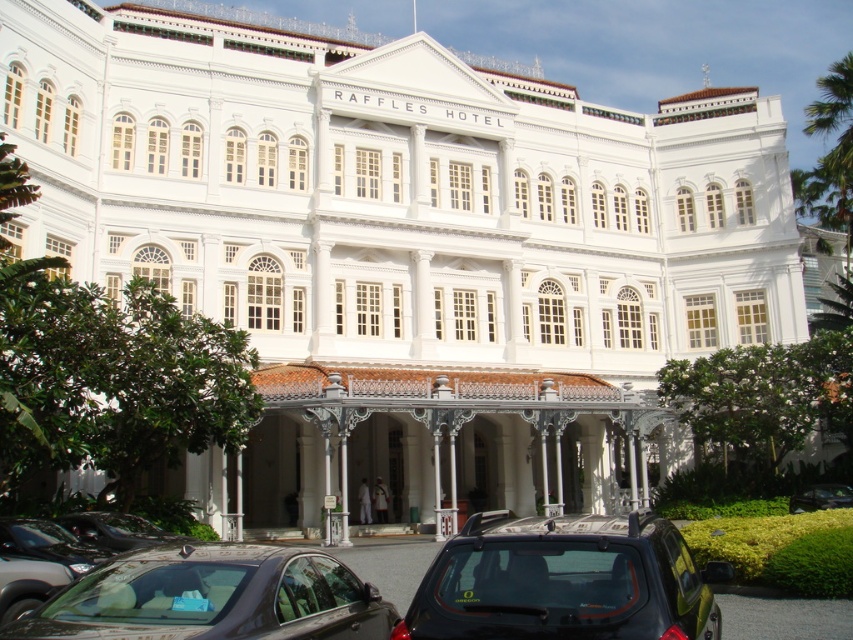
Is black matte car at lower center closer to camera compared to shiny black sedan at lower center?

No.

Can you confirm if black matte car at lower center is bigger than shiny black sedan at lower center?

Yes, black matte car at lower center is bigger than shiny black sedan at lower center.

Which is behind, point (457, 576) or point (144, 572)?

Point (457, 576)

Image resolution: width=853 pixels, height=640 pixels. Find the location of `black matte car at lower center`. black matte car at lower center is located at coordinates (564, 580).

Is the position of shiny silver car at lower left less distant than that of metallic silver car at lower center?

Yes.

Between point (39, 577) and point (833, 499), which one is positioned behind?

The point (833, 499) is behind.

Locate an element on the screen. shiny silver car at lower left is located at coordinates (38, 563).

Where is `shiny silver car at lower left`? shiny silver car at lower left is located at coordinates (38, 563).

Who is more forward, (666, 577) or (808, 506)?

Positioned in front is point (666, 577).

In the scene shown: Can you confirm if black matte car at lower center is thinner than metallic silver car at lower center?

Incorrect, black matte car at lower center's width is not less than metallic silver car at lower center's.

Where is `black matte car at lower center`? The width and height of the screenshot is (853, 640). black matte car at lower center is located at coordinates (564, 580).